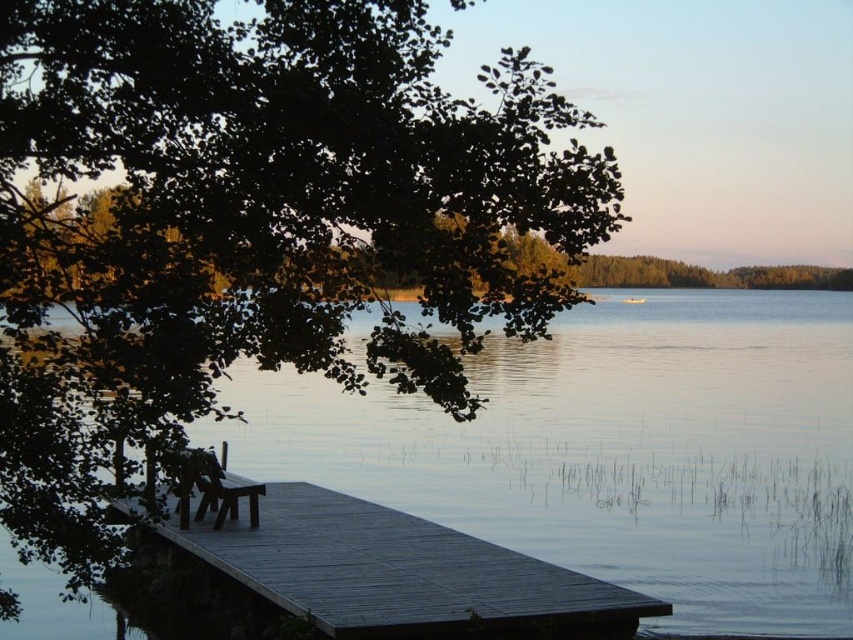
You are standing at the end of the wooden dock and looking towards the upper left corner of the image. What object is located at the coordinates point [253,221]?

The point [253,221] marks the location of the green leafy tree at upper left.

You are planning to build a small wooden platform on the dock to place a telescope. The platform must be wider than the green leafy tree at upper left but narrower than the transparent water at center. Is this possible? Please explain.

The green leafy tree at upper left is thinner than the transparent water at center. Therefore, since the platform needs to be wider than the tree but narrower than the water, it is possible as there is a width range available between the two.